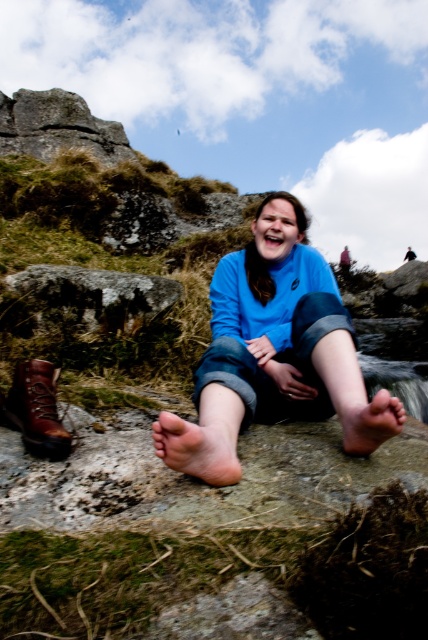
Which is more to the left, blue cotton sweatshirt at center or brown leather boot at lower left?

From the viewer's perspective, brown leather boot at lower left appears more on the left side.

Is point (202, 410) closer to viewer compared to point (26, 426)?

No, (202, 410) is behind (26, 426).

Is point (297, 224) in front of point (14, 422)?

No.

The width and height of the screenshot is (428, 640). I want to click on blue cotton sweatshirt at center, so click(x=270, y=356).